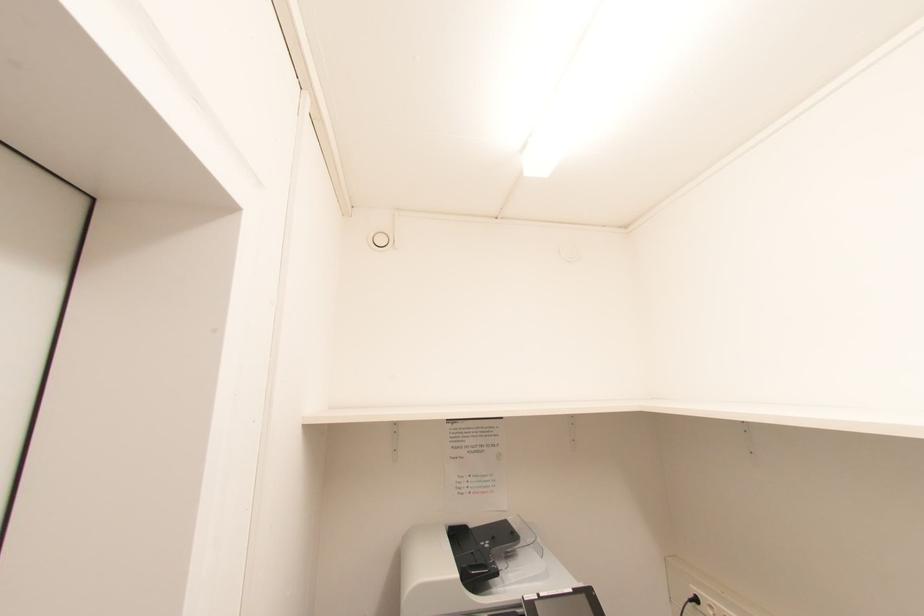
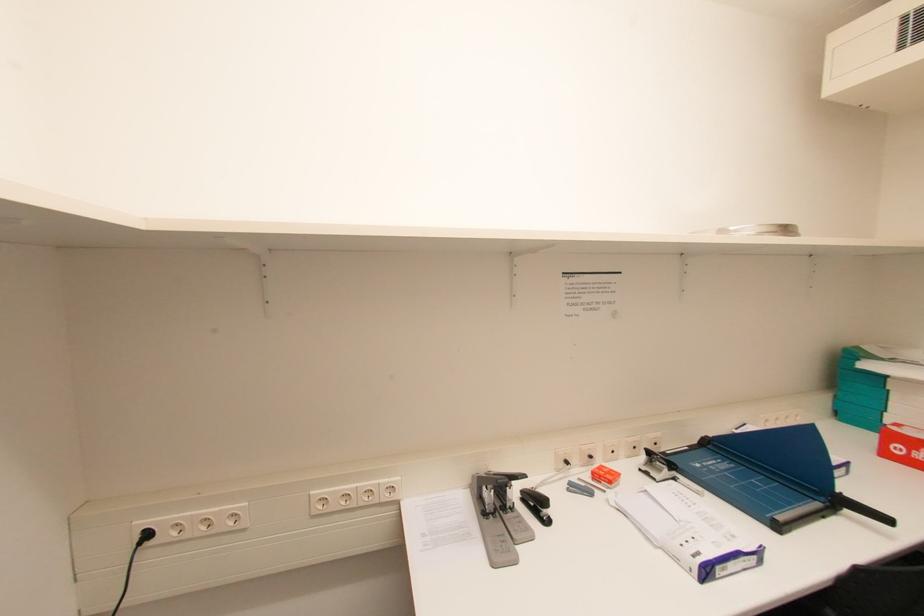
Question: Based on the continuous images, in which direction is the camera rotating? Reply with the corresponding letter.

Choices:
 (A) Left
 (B) Right
 (C) Up
 (D) Down

Answer: (B)